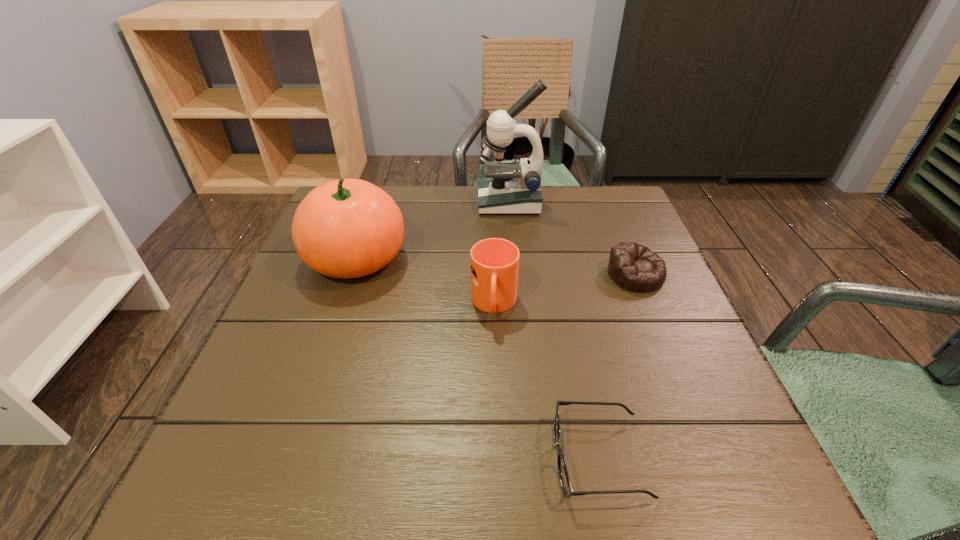
At what (x,y) coordinates should I click in order to perform the action: click on object present at the right edge. Please return your answer as a coordinate pair (x, y). Looking at the image, I should click on (636, 268).

This screenshot has height=540, width=960. In order to click on object that is at the far left corner in this screenshot , I will do `click(348, 228)`.

Locate an element on the screen. vacant space at the far edge is located at coordinates (437, 208).

Image resolution: width=960 pixels, height=540 pixels. Find the location of `vacant space at the near edge of the desktop`. vacant space at the near edge of the desktop is located at coordinates (515, 469).

Image resolution: width=960 pixels, height=540 pixels. Identify the location of free space at the left edge of the desktop. (347, 311).

In the image, there is a desktop. At what (x,y) coordinates should I click in order to perform the action: click on vacant region at the right edge. Please return your answer as a coordinate pair (x, y). The height and width of the screenshot is (540, 960). Looking at the image, I should click on (682, 301).

Identify the location of vacant region at the far right corner of the desktop. (633, 220).

This screenshot has width=960, height=540. In the image, there is a desktop. What are the coordinates of `vacant space at the near right corner` in the screenshot? It's located at (732, 489).

You are a GUI agent. You are given a task and a screenshot of the screen. Output one action in this format:
    pyautogui.click(x=<x>, y=<y>)
    Task: Click on the free area in between the rightmost object and the third tallest object
    The height and width of the screenshot is (540, 960).
    Given the screenshot: What is the action you would take?
    pyautogui.click(x=564, y=289)

Find the location of a particular element. Image resolution: width=960 pixels, height=540 pixels. free space between the spectacles and the leftmost object is located at coordinates coord(477,358).